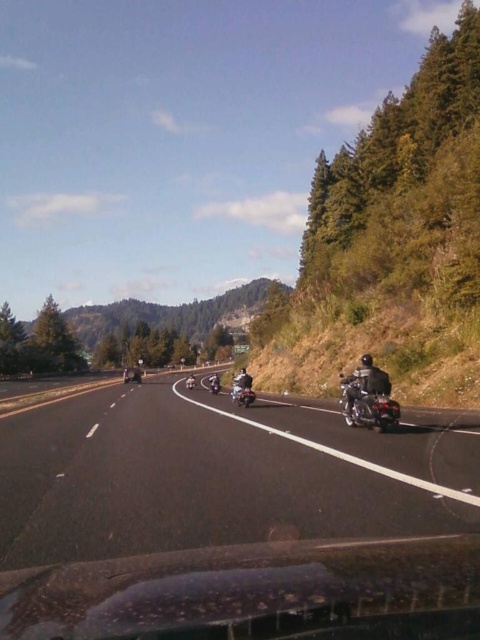
Can you confirm if black asphalt road at center is thinner than dark gray leather jacket at right?

Incorrect, black asphalt road at center's width is not less than dark gray leather jacket at right's.

How far apart are black asphalt road at center and dark gray leather jacket at right?

They are 6.46 meters apart.

The height and width of the screenshot is (640, 480). What do you see at coordinates (216, 476) in the screenshot? I see `black asphalt road at center` at bounding box center [216, 476].

The height and width of the screenshot is (640, 480). Identify the location of black asphalt road at center. (216, 476).

Does transparent glass windshield at lower center have a greater height compared to shiny chrome motorcycle at center?

In fact, transparent glass windshield at lower center may be shorter than shiny chrome motorcycle at center.

At what (x,y) coordinates should I click in order to perform the action: click on transparent glass windshield at lower center. Please return your answer as a coordinate pair (x, y). The height and width of the screenshot is (640, 480). Looking at the image, I should click on (255, 593).

Does shiny chrome motorcycle at right appear over shiny silver motorcycle at center?

Yes.

Does shiny chrome motorcycle at right have a lesser width compared to shiny silver motorcycle at center?

In fact, shiny chrome motorcycle at right might be wider than shiny silver motorcycle at center.

What do you see at coordinates (369, 400) in the screenshot? The height and width of the screenshot is (640, 480). I see `shiny chrome motorcycle at right` at bounding box center [369, 400].

Identify the location of shiny chrome motorcycle at right. (369, 400).